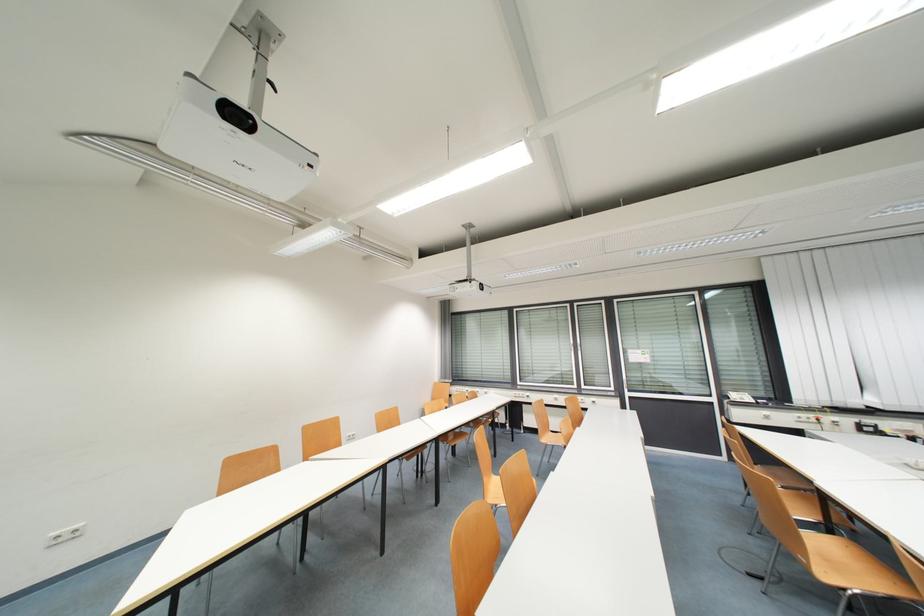
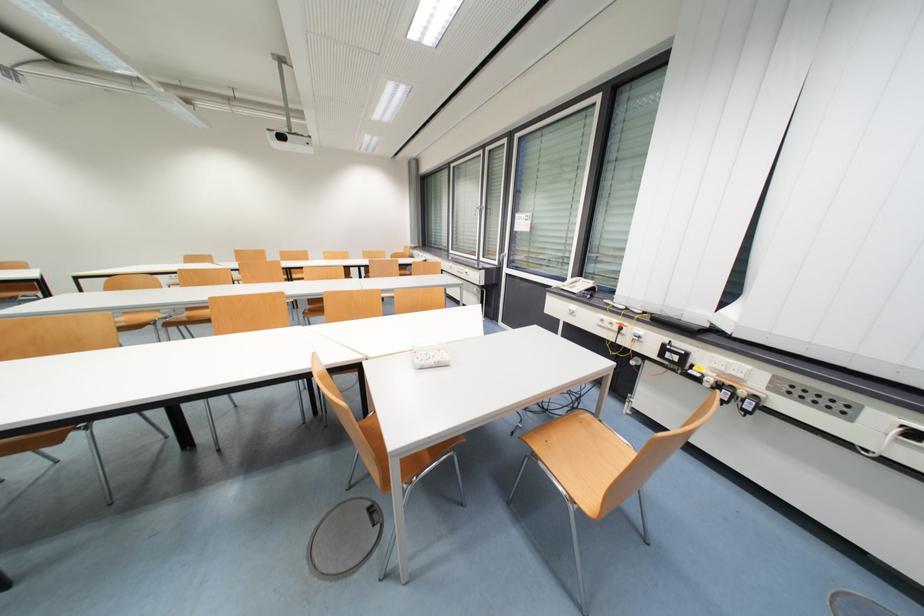
The point at (816, 416) is marked in the first image. Where is the corresponding point in the second image?

(622, 323)